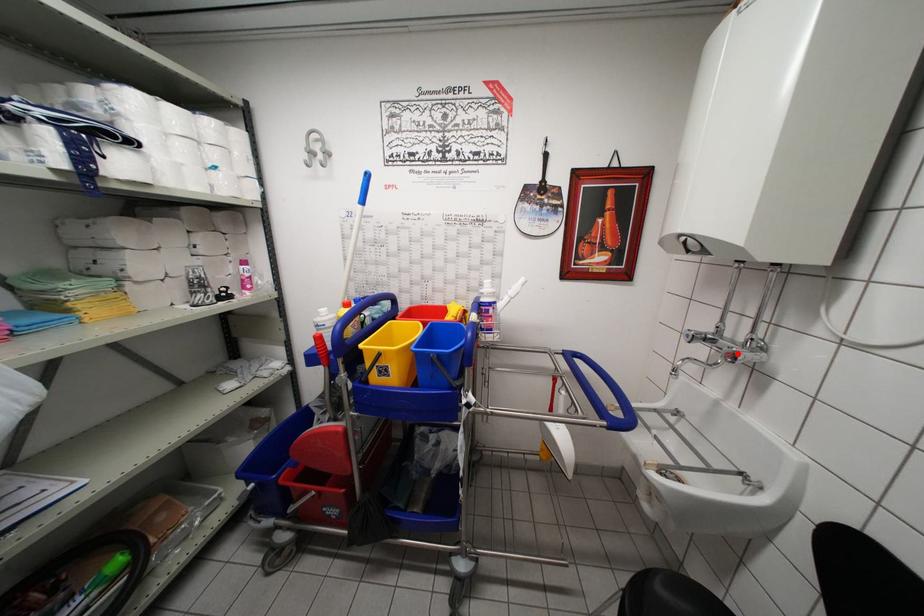
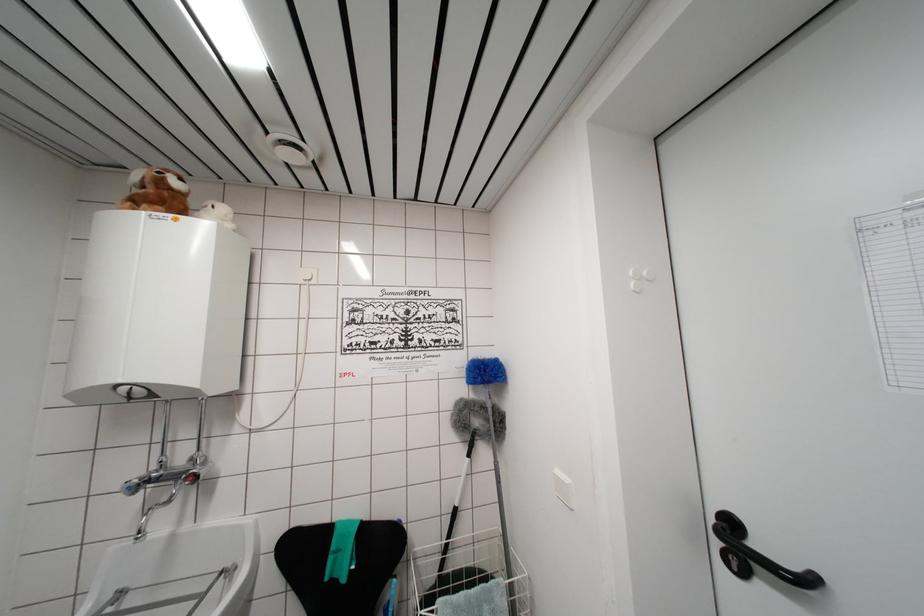
Question: I am providing you with two images of the same scene from different viewpoints. A red point is marked on the first image. At the location where the point appears in image 1, is it still visible in image 2?

Choices:
 (A) Yes
 (B) No

Answer: (A)